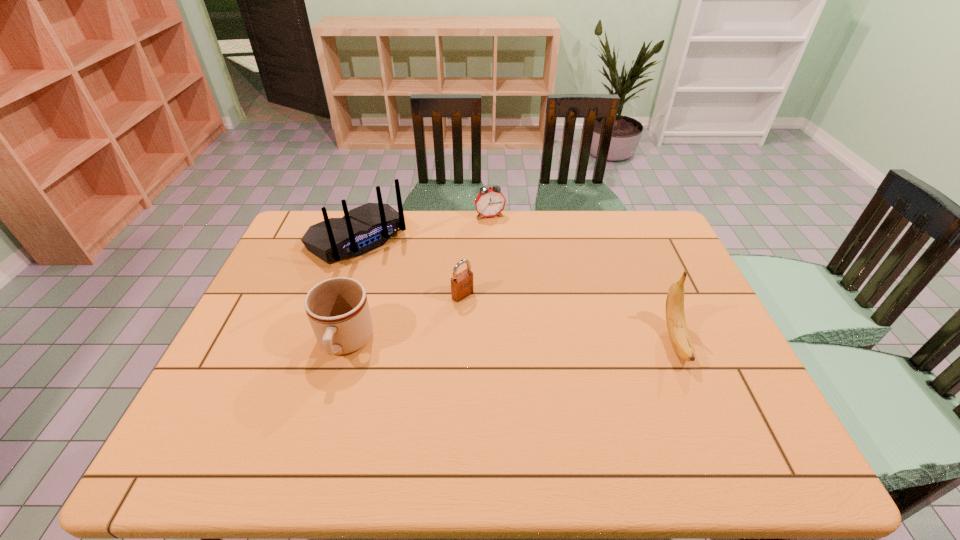
This screenshot has height=540, width=960. In order to click on mug in this screenshot , I will do `click(337, 308)`.

Locate an element on the screen. banana is located at coordinates (675, 316).

Identify the location of the second tallest object. (675, 316).

You are a GUI agent. You are given a task and a screenshot of the screen. Output one action in this format:
    pyautogui.click(x=<x>, y=<y>)
    Task: Click on the third farthest object
    The width and height of the screenshot is (960, 540).
    Given the screenshot: What is the action you would take?
    pyautogui.click(x=461, y=284)

This screenshot has height=540, width=960. Identify the location of alarm clock. (490, 202).

At what (x,y) coordinates should I click in order to perform the action: click on router. Please return your answer as a coordinate pair (x, y). Looking at the image, I should click on (367, 227).

The image size is (960, 540). I want to click on free space located on the side of the mug with the handle, so click(x=325, y=411).

Locate an element on the screen. This screenshot has width=960, height=540. free space located on the front-facing side of the third farthest object is located at coordinates (523, 342).

This screenshot has width=960, height=540. I want to click on free location located on the front-facing side of the third farthest object, so click(512, 333).

Find the location of a particular element. free space located 0.380m on the front-facing side of the third farthest object is located at coordinates (574, 382).